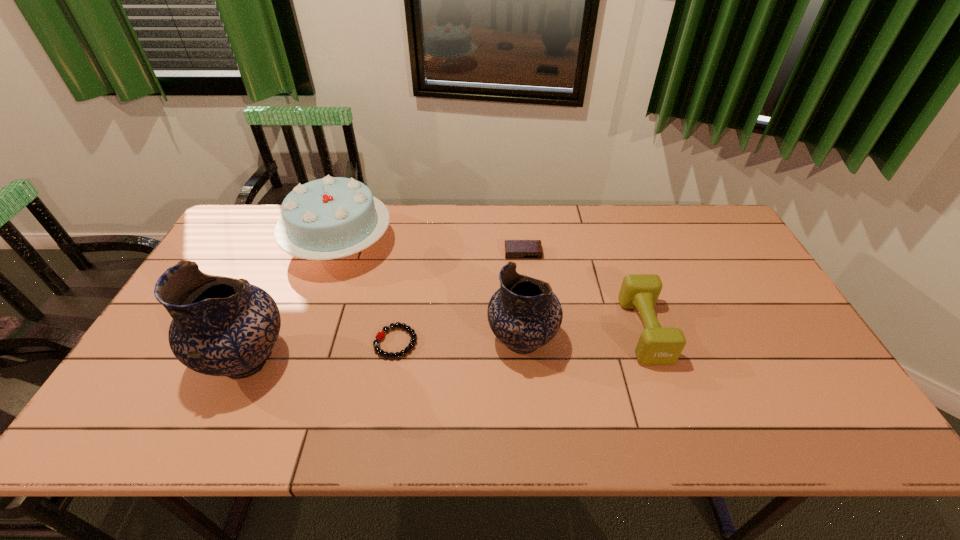
The height and width of the screenshot is (540, 960). I want to click on vacant space located 0.310m on the left of the right pottery, so click(x=369, y=340).

Where is `free region located 0.140m on the front of the birthday cake`? The height and width of the screenshot is (540, 960). free region located 0.140m on the front of the birthday cake is located at coordinates (313, 319).

Find the location of a particular element. Image resolution: width=960 pixels, height=540 pixels. free space located 0.090m on the front face of the second shortest object is located at coordinates (526, 279).

I want to click on vacant space situated on the left of the shortest object, so point(336,342).

Where is `vacant region located on the back of the third shortest object`? Image resolution: width=960 pixels, height=540 pixels. vacant region located on the back of the third shortest object is located at coordinates (626, 276).

Locate an element on the screen. The image size is (960, 540). birthday cake positioned at the far edge is located at coordinates 333,217.

This screenshot has width=960, height=540. Find the location of `alarm clock present at the far edge`. alarm clock present at the far edge is located at coordinates (514, 249).

Locate an element on the screen. The width and height of the screenshot is (960, 540). object that is at the left edge is located at coordinates (221, 326).

Where is `object located in the near left corner section of the desktop`? This screenshot has width=960, height=540. object located in the near left corner section of the desktop is located at coordinates (221, 326).

Locate an element on the screen. vacant area at the far edge of the desktop is located at coordinates (534, 221).